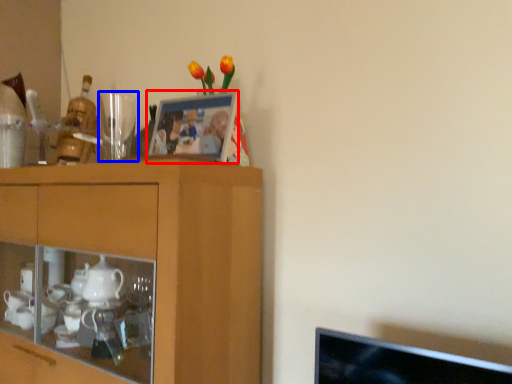
Question: Among these objects, which one is nearest to the camera, picture frame (highlighted by a red box) or tableware (highlighted by a blue box)?

Choices:
 (A) picture frame
 (B) tableware

Answer: (A)